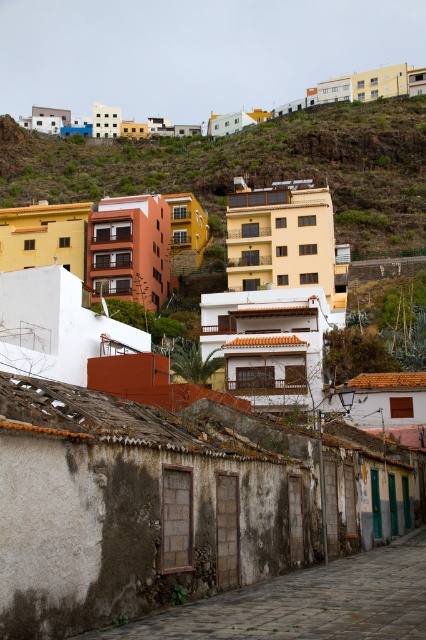
Based on the coordinates provided, which building in the scene is located at point (249, 166)?

The yellow matte building at upper center is located at point (249, 166).

You are a tourist standing on the cobblestone street and want to take a photo of the yellow matte building at upper center and the pastel painted houses at upper left. Which one is located more to the left side?

The yellow matte building at upper center is positioned on the left side of pastel painted houses at upper left.

You are standing at the point marked as point (249, 166) in the image. What building are you facing?

You are facing the yellow matte building at upper center.